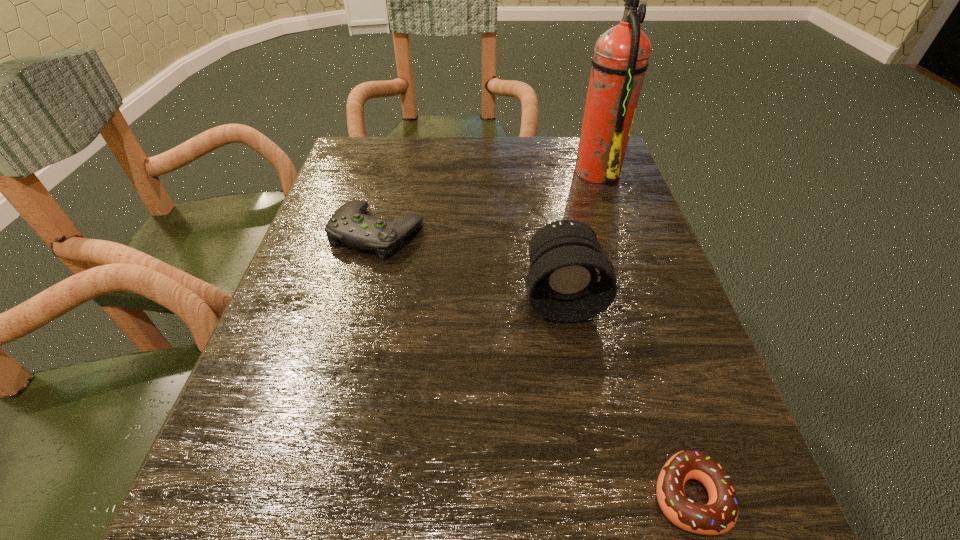
Image resolution: width=960 pixels, height=540 pixels. What are the coordinates of `vacant area that lies between the control and the doughnut` in the screenshot? It's located at (534, 364).

The height and width of the screenshot is (540, 960). Identify the location of free space between the doughnut and the fire extinguisher. (643, 333).

This screenshot has height=540, width=960. What are the coordinates of `free space between the nearest object and the telephoto lens` in the screenshot? It's located at (626, 395).

This screenshot has width=960, height=540. In order to click on object that is the closest to the fire extinguisher in this screenshot , I will do `click(569, 280)`.

Locate which object ranks second in proximity to the tallest object. Please provide its 2D coordinates. Your answer should be formatted as a tuple, i.e. [(x, y)], where the tuple contains the x and y coordinates of a point satisfying the conditions above.

[(349, 225)]

You are a GUI agent. You are given a task and a screenshot of the screen. Output one action in this format:
    pyautogui.click(x=<x>, y=<y>)
    Task: Click on the free location that satisfies the following two spatial constraints: 1. at the nozzle of the tallest object; 2. at the front element of the second nearest object
    The width and height of the screenshot is (960, 540).
    Given the screenshot: What is the action you would take?
    pyautogui.click(x=640, y=295)

Identify the location of vacant position in the image that satisfies the following two spatial constraints: 1. at the front element of the telephoto lens; 2. on the right side of the doughnut. The image size is (960, 540). [x=597, y=496].

This screenshot has width=960, height=540. Identify the location of vacant area in the image that satisfies the following two spatial constraints: 1. at the nozzle of the tallest object; 2. at the front element of the third farthest object. (640, 295).